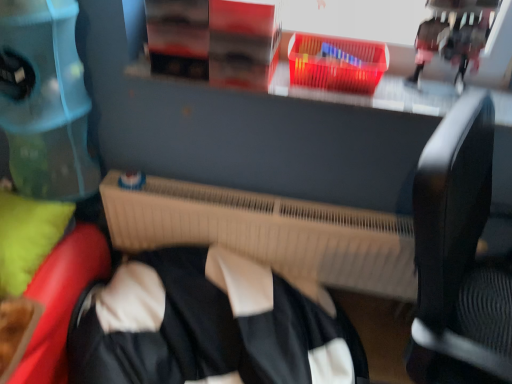
What do you see at coordinates (209, 325) in the screenshot?
I see `black matte jacket at center` at bounding box center [209, 325].

Where is `beige plastic radiator at center`? Image resolution: width=512 pixels, height=384 pixels. beige plastic radiator at center is located at coordinates (268, 232).

What do you see at coordinates (268, 232) in the screenshot?
I see `beige plastic radiator at center` at bounding box center [268, 232].

Locate an element on the screen. The image size is (512, 384). translucent plastic basket at upper center is located at coordinates (336, 63).

Measure the distance between point (62, 210) and camera.

Point (62, 210) and camera are 1.34 meters apart.

Where is `black matte jacket at center`? This screenshot has width=512, height=384. black matte jacket at center is located at coordinates (209, 325).

From the image's perspective, would you say translucent plastic basket at upper center is positioned over beige plastic radiator at center?

Yes, from the image's perspective, translucent plastic basket at upper center is over beige plastic radiator at center.

Is translucent plastic basket at upper center in front of beige plastic radiator at center?

Yes, translucent plastic basket at upper center is in front of beige plastic radiator at center.

The width and height of the screenshot is (512, 384). Identify the location of basket on the right of beige plastic radiator at center. (336, 63).

Is beige plastic radiator at center located within translucent plastic basket at upper center?

No, translucent plastic basket at upper center does not contain beige plastic radiator at center.

Does black matte jacket at center contain translucent plastic basket at upper center?

No, translucent plastic basket at upper center is not inside black matte jacket at center.

From the image's perspective, would you say black matte jacket at center is positioned over translucent plastic basket at upper center?

No.

Can you tell me how much black matte jacket at center and translucent plastic basket at upper center differ in facing direction?

0.0988 degrees.

Which of these two, black matte jacket at center or translucent plastic basket at upper center, is bigger?

Bigger between the two is black matte jacket at center.

Is point (8, 253) closer or farther from the camera than point (332, 37)?

Clearly, point (8, 253) is closer to the camera than point (332, 37).

Is green fabric pillow at lower left facing away from translucent plastic basket at upper center?

No.

Is green fabric pillow at lower left wider or thinner than translucent plastic basket at upper center?

In the image, green fabric pillow at lower left appears to be wider than translucent plastic basket at upper center.

Consider the image. How much distance is there between green fabric pillow at lower left and translucent plastic basket at upper center?

93.54 centimeters.

Does black matte jacket at center lie behind green fabric pillow at lower left?

No, the depth of black matte jacket at center is less than that of green fabric pillow at lower left.

Is point (324, 347) closer or farther from the camera than point (39, 259)?

Clearly, point (324, 347) is more distant from the camera than point (39, 259).

This screenshot has height=384, width=512. In order to click on pillow behind the black matte jacket at center in this screenshot , I will do `click(27, 237)`.

Is beige plastic radiator at center bigger than black matte jacket at center?

No, beige plastic radiator at center is not bigger than black matte jacket at center.

What are the coordinates of `clothing that appears on the left of beige plastic radiator at center` in the screenshot? It's located at (209, 325).

Is point (149, 248) positioned before point (246, 262)?

No, it is behind (246, 262).

How much distance is there between black matte jacket at center and beige plastic radiator at center?

black matte jacket at center is 9.20 inches away from beige plastic radiator at center.

Is black matte jacket at center positioned in front of beige plastic radiator at center?

Yes, it is.

How different are the orientations of black matte jacket at center and beige plastic radiator at center in degrees?

0.357 degrees.

Which of these two, black matte jacket at center or beige plastic radiator at center, stands shorter?

With less height is beige plastic radiator at center.

Considering the positions of objects green fabric pillow at lower left and beige plastic radiator at center in the image provided, who is behind, green fabric pillow at lower left or beige plastic radiator at center?

beige plastic radiator at center is behind.

From the image's perspective, which one is positioned higher, green fabric pillow at lower left or beige plastic radiator at center?

green fabric pillow at lower left is shown above in the image.

From a real-world perspective, which object rests below the other?

From a 3D spatial view, beige plastic radiator at center is below.

Considering the sizes of green fabric pillow at lower left and beige plastic radiator at center in the image, is green fabric pillow at lower left taller or shorter than beige plastic radiator at center?

Clearly, green fabric pillow at lower left is shorter compared to beige plastic radiator at center.

At what (x,y) coordinates should I click in order to perform the action: click on radiator that is behind the translucent plastic basket at upper center. Please return your answer as a coordinate pair (x, y). Looking at the image, I should click on (268, 232).

You are a GUI agent. You are given a task and a screenshot of the screen. Output one action in this format:
    pyautogui.click(x=<x>, y=<y>)
    Task: Click on the clothing located below the translucent plastic basket at upper center (from the image's perspective)
    
    Given the screenshot: What is the action you would take?
    209,325

When comparing their distances from beige plastic radiator at center, does black matte jacket at center or green fabric pillow at lower left seem closer?

The object closer to beige plastic radiator at center is black matte jacket at center.

Based on their spatial positions, is beige plastic radiator at center or translucent plastic basket at upper center closer to black matte jacket at center?

Among the two, beige plastic radiator at center is located nearer to black matte jacket at center.

Looking at the image, which one is located closer to black matte jacket at center, translucent plastic basket at upper center or green fabric pillow at lower left?

Among the two, green fabric pillow at lower left is located nearer to black matte jacket at center.

Which object lies nearer to the anchor point black matte jacket at center, green fabric pillow at lower left or beige plastic radiator at center?

Based on the image, beige plastic radiator at center appears to be nearer to black matte jacket at center.

Which object lies nearer to the anchor point beige plastic radiator at center, black matte jacket at center or translucent plastic basket at upper center?

black matte jacket at center is closer to beige plastic radiator at center.

Based on their spatial positions, is black matte jacket at center or green fabric pillow at lower left further from translucent plastic basket at upper center?

green fabric pillow at lower left lies further to translucent plastic basket at upper center than the other object.

Based on their spatial positions, is green fabric pillow at lower left or black matte jacket at center further from translucent plastic basket at upper center?

Based on the image, green fabric pillow at lower left appears to be further to translucent plastic basket at upper center.

Considering their positions, is beige plastic radiator at center positioned further to translucent plastic basket at upper center than green fabric pillow at lower left?

green fabric pillow at lower left is further to translucent plastic basket at upper center.

What are the coordinates of `radiator between green fabric pillow at lower left and translucent plastic basket at upper center in the horizontal direction` in the screenshot? It's located at (268, 232).

Where is `clothing between green fabric pillow at lower left and translucent plastic basket at upper center from left to right`? clothing between green fabric pillow at lower left and translucent plastic basket at upper center from left to right is located at coordinates [x=209, y=325].

Identify the location of clothing situated between green fabric pillow at lower left and beige plastic radiator at center from left to right. Image resolution: width=512 pixels, height=384 pixels. (209, 325).

This screenshot has height=384, width=512. In order to click on radiator between translucent plastic basket at upper center and black matte jacket at center from top to bottom in this screenshot , I will do tap(268, 232).